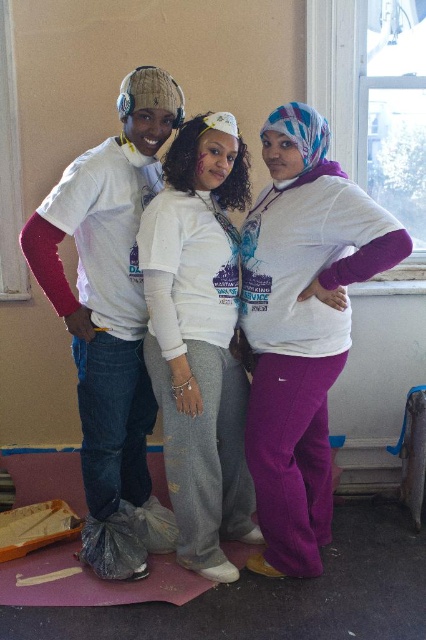
Question: Which point appears closest to the camera in this image?

Choices:
 (A) click(x=307, y=218)
 (B) click(x=141, y=289)
 (C) click(x=229, y=132)

Answer: (A)

Question: Does white matte t-shirt at left come behind white soft sweatshirt at center?

Choices:
 (A) no
 (B) yes

Answer: (A)

Question: Is purple fleece pants at center behind white soft sweatshirt at center?

Choices:
 (A) yes
 (B) no

Answer: (B)

Question: Among these objects, which one is nearest to the camera?

Choices:
 (A) purple fleece pants at center
 (B) white soft sweatshirt at center

Answer: (A)

Question: From the image, what is the correct spatial relationship of white matte t-shirt at left in relation to white soft sweatshirt at center?

Choices:
 (A) above
 (B) below

Answer: (A)

Question: Considering the real-world distances, which object is closest to the white soft sweatshirt at center?

Choices:
 (A) purple fleece pants at center
 (B) white matte t-shirt at left

Answer: (A)